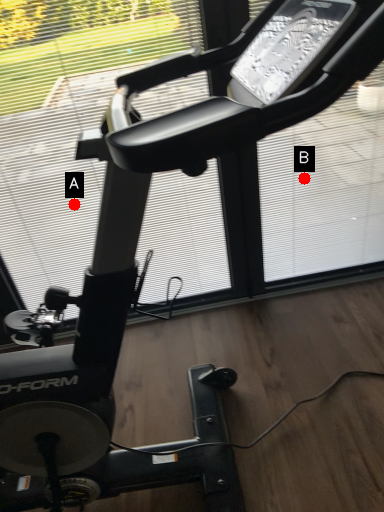
Question: Two points are circled on the image, labeled by A and B beside each circle. Which point appears closest to the camera in this image?

Choices:
 (A) A is closer
 (B) B is closer

Answer: (A)